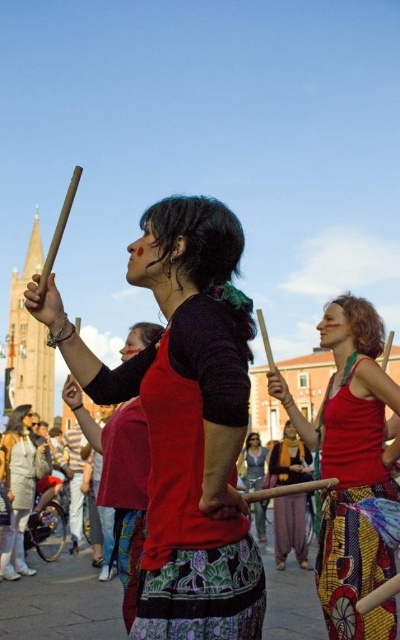
Measure the distance between point (222,541) and camera.

Point (222,541) and camera are 80.06 meters apart.

Who is more distant from viewer, [174,433] or [28,508]?

The point [28,508] is more distant.

Find the location of a particular element. The image size is (400, 640). matte black drumstick at center is located at coordinates (185, 420).

From the picture: Who is lower down, matte silver helmet at lower left or matte yellow scarf at center?

Positioned lower is matte silver helmet at lower left.

Does matte silver helmet at lower left have a greater width compared to matte yellow scarf at center?

Correct, the width of matte silver helmet at lower left exceeds that of matte yellow scarf at center.

Image resolution: width=400 pixels, height=640 pixels. I want to click on matte silver helmet at lower left, so click(x=20, y=486).

Locate an element on the screen. matte silver helmet at lower left is located at coordinates (20, 486).

Who is higher up, matte black drumstick at center or matte yellow scarf at center?

matte black drumstick at center is above.

How much distance is there between matte black drumstick at center and matte yellow scarf at center?

matte black drumstick at center and matte yellow scarf at center are 29.97 meters apart.

Who is more forward, (161, 586) or (302, 502)?

Point (161, 586) is more forward.

At what (x,y) coordinates should I click in order to perform the action: click on matte black drumstick at center. Please return your answer as a coordinate pair (x, y). This screenshot has height=640, width=400. Looking at the image, I should click on (185, 420).